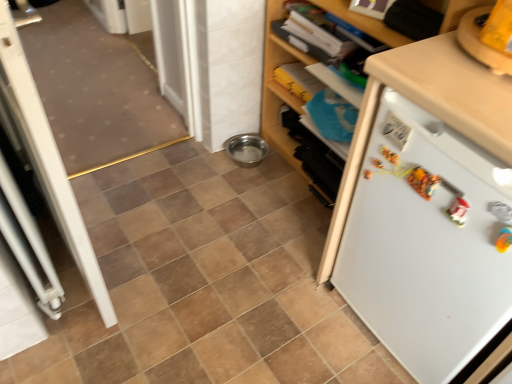
Question: Is white matte cabinet at upper right taller or shorter than white matte refrigerator at right?

Choices:
 (A) short
 (B) tall

Answer: (B)

Question: From a real-world perspective, is white matte cabinet at upper right above or below white matte refrigerator at right?

Choices:
 (A) below
 (B) above

Answer: (B)

Question: Estimate the real-world distances between objects in this image. Which object is closer to the brown matte tile at center?

Choices:
 (A) white matte cabinet at upper right
 (B) white matte refrigerator at right
 (C) white plastic screen door at left

Answer: (C)

Question: Which object is positioned farthest from the brown matte tile at center?

Choices:
 (A) white plastic screen door at left
 (B) white matte cabinet at upper right
 (C) white matte refrigerator at right

Answer: (B)